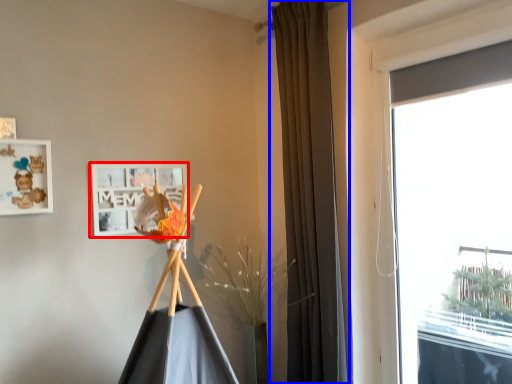
Question: Which object appears closest to the camera in this image, picture frame (highlighted by a red box) or curtain (highlighted by a blue box)?

Choices:
 (A) picture frame
 (B) curtain

Answer: (B)